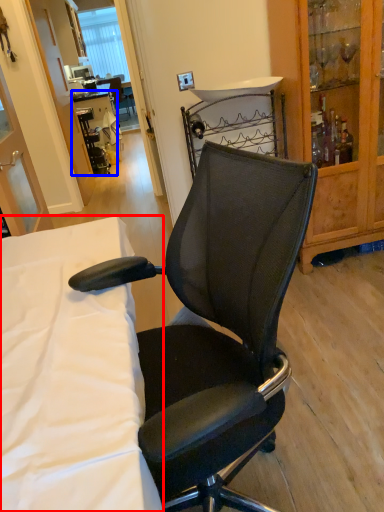
Question: Which of the following is the farthest to the observer, desk (highlighted by a red box) or table (highlighted by a blue box)?

Choices:
 (A) desk
 (B) table

Answer: (B)